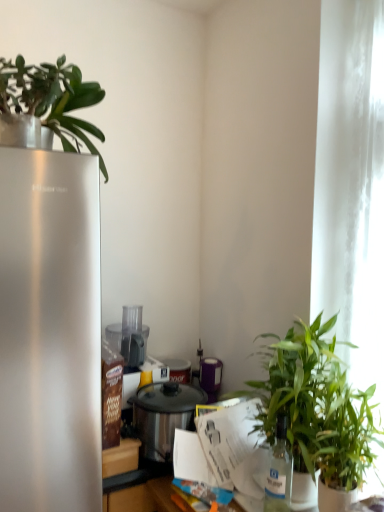
This screenshot has height=512, width=384. What do you see at coordinates (163, 416) in the screenshot?
I see `stainless steel pot at center` at bounding box center [163, 416].

In order to click on green leafy plant at right, the 2th houseplant in the right-to-left sequence in this screenshot , I will do `click(297, 393)`.

You are a GUI agent. You are given a task and a screenshot of the screen. Output one action in this format:
    pyautogui.click(x=<x>, y=<y>)
    Task: Click on the white glossy paper at center
    The height and width of the screenshot is (512, 384).
    Given the screenshot: What is the action you would take?
    point(232,445)

Identify the location of white sheer curtain at right. point(351,186).

Where is `stainless steel pot at center`? The width and height of the screenshot is (384, 512). stainless steel pot at center is located at coordinates (163, 416).

Considering the relative sizes of stainless steel pot at center and clear glass bottle at lower right in the image provided, is stainless steel pot at center shorter than clear glass bottle at lower right?

Correct, stainless steel pot at center is not as tall as clear glass bottle at lower right.

Does stainless steel pot at center have a larger size compared to clear glass bottle at lower right?

Indeed, stainless steel pot at center has a larger size compared to clear glass bottle at lower right.

Are stainless steel pot at center and clear glass bottle at lower right located far from each other?

Actually, stainless steel pot at center and clear glass bottle at lower right are a little close together.

Which of these two, stainless steel pot at center or clear glass bottle at lower right, is wider?

With larger width is stainless steel pot at center.

What's the angular difference between green matte plant at upper left, placed as the 1th houseplant when sorted from top to bottom, and clear glass bottle at lower right's facing directions?

There is a 87.2-degree angle between the facing directions of green matte plant at upper left, placed as the 1th houseplant when sorted from top to bottom, and clear glass bottle at lower right.

Is green matte plant at upper left, the third houseplant positioned from the right, oriented towards clear glass bottle at lower right?

No, green matte plant at upper left, the third houseplant positioned from the right, is not turned towards clear glass bottle at lower right.

Is green matte plant at upper left, placed as the 1th houseplant when sorted from top to bottom, shorter than clear glass bottle at lower right?

Indeed, green matte plant at upper left, placed as the 1th houseplant when sorted from top to bottom, has a lesser height compared to clear glass bottle at lower right.

From the image's perspective, is green matte plant at upper left, placed as the third houseplant when sorted from bottom to top, on top of clear glass bottle at lower right?

Correct, green matte plant at upper left, placed as the third houseplant when sorted from bottom to top, appears higher than clear glass bottle at lower right in the image.

Is green leafy plant at right, the 3th houseplant positioned from the top, looking in the opposite direction of green matte plant at upper left, the third houseplant positioned from the right?

No, green leafy plant at right, the 3th houseplant positioned from the top,'s orientation is not away from green matte plant at upper left, the third houseplant positioned from the right.

Between green leafy plant at right, the third houseplant positioned from the left, and green matte plant at upper left, the third houseplant positioned from the right, which one appears on the right side from the viewer's perspective?

From the viewer's perspective, green leafy plant at right, the third houseplant positioned from the left, appears more on the right side.

How different are the orientations of green leafy plant at right, the 3th houseplant positioned from the top, and green matte plant at upper left, placed as the 1th houseplant when sorted from top to bottom, in degrees?

The angular difference between green leafy plant at right, the 3th houseplant positioned from the top, and green matte plant at upper left, placed as the 1th houseplant when sorted from top to bottom, is 87.2 degrees.

Between green leafy plant at right, the 3th houseplant positioned from the top, and green matte plant at upper left, placed as the third houseplant when sorted from bottom to top, which one has larger width?

green leafy plant at right, the 3th houseplant positioned from the top, is wider.

From a real-world perspective, between green leafy plant at right, the 1th houseplant in the bottom-to-top sequence, and stainless steel pot at center, who is vertically lower?

From a 3D spatial view, stainless steel pot at center is below.

Who is smaller, green leafy plant at right, the 1th houseplant in the bottom-to-top sequence, or stainless steel pot at center?

stainless steel pot at center.

In terms of height, does green leafy plant at right, the 1th houseplant in the bottom-to-top sequence, look taller or shorter compared to stainless steel pot at center?

green leafy plant at right, the 1th houseplant in the bottom-to-top sequence, is taller than stainless steel pot at center.

Is stainless steel pot at center facing away from green leafy plant at right, the 1th houseplant positioned from the right?

No, green leafy plant at right, the 1th houseplant positioned from the right, is not at the back of stainless steel pot at center.

Is stainless steel pot at center surrounding green leafy plant at right, the 3th houseplant positioned from the top?

Definitely not — green leafy plant at right, the 3th houseplant positioned from the top, is not inside stainless steel pot at center.

Is point (169, 426) farther from camera compared to point (342, 464)?

That is True.

Is stainless steel pot at center smaller than green leafy plant at right, the third houseplant positioned from the left?

Yes, stainless steel pot at center is smaller than green leafy plant at right, the third houseplant positioned from the left.

Does green leafy plant at right, the 1th houseplant in the bottom-to-top sequence, have a greater width compared to white glossy paper at center?

Correct, the width of green leafy plant at right, the 1th houseplant in the bottom-to-top sequence, exceeds that of white glossy paper at center.

Does point (327, 421) appear closer or farther from the camera than point (213, 460)?

Point (327, 421).

How different are the orientations of green leafy plant at right, the 1th houseplant positioned from the right, and white glossy paper at center in degrees?

The angular difference between green leafy plant at right, the 1th houseplant positioned from the right, and white glossy paper at center is 85 degrees.

Is clear glass bottle at lower right completely or partially outside of green leafy plant at right, the second houseplant in the left-to-right sequence?

No.

Considering the sizes of objects clear glass bottle at lower right and green leafy plant at right, placed as the 2th houseplant when sorted from top to bottom, in the image provided, who is thinner, clear glass bottle at lower right or green leafy plant at right, placed as the 2th houseplant when sorted from top to bottom,?

With smaller width is clear glass bottle at lower right.

Which object is positioned more to the right, clear glass bottle at lower right or green leafy plant at right, the second houseplant in the left-to-right sequence?

green leafy plant at right, the second houseplant in the left-to-right sequence.

Identify the location of bottle below the stainless steel pot at center (from the image's perspective). The width and height of the screenshot is (384, 512). (279, 472).

Identify the location of houseplant on the left of clear glass bottle at lower right. This screenshot has height=512, width=384. (52, 99).

Which object lies further to the anchor point stainless steel pot at center, green matte plant at upper left, placed as the 1th houseplant when sorted from top to bottom, or clear glass bottle at lower right?

The object further to stainless steel pot at center is green matte plant at upper left, placed as the 1th houseplant when sorted from top to bottom.

When comparing their distances from clear glass bottle at lower right, does white ceramic pot at lower right or white sheer curtain at right seem further?

white sheer curtain at right lies further to clear glass bottle at lower right than the other object.

Looking at the image, which one is located closer to green leafy plant at right, the 2th houseplant in the right-to-left sequence, clear glass bottle at lower right or stainless steel pot at center?

Based on the image, clear glass bottle at lower right appears to be nearer to green leafy plant at right, the 2th houseplant in the right-to-left sequence.

When comparing their distances from white ceramic pot at lower right, does green leafy plant at right, the 3th houseplant positioned from the top, or white sheer curtain at right seem closer?

Among the two, green leafy plant at right, the 3th houseplant positioned from the top, is located nearer to white ceramic pot at lower right.

From the picture: Considering their positions, is green leafy plant at right, the 2th houseplant in the right-to-left sequence, positioned further to clear glass bottle at lower right than white glossy paper at center?

white glossy paper at center is further to clear glass bottle at lower right.

Considering their positions, is clear glass bottle at lower right positioned closer to green matte plant at upper left, the third houseplant positioned from the right, than stainless steel pot at center?

stainless steel pot at center is positioned closer to the anchor green matte plant at upper left, the third houseplant positioned from the right.

Estimate the real-world distances between objects in this image. Which object is closer to white sheer curtain at right, stainless steel pot at center or green leafy plant at right, the 1th houseplant in the bottom-to-top sequence?

Among the two, green leafy plant at right, the 1th houseplant in the bottom-to-top sequence, is located nearer to white sheer curtain at right.

Which object lies nearer to the anchor point green matte plant at upper left, the third houseplant positioned from the right, green leafy plant at right, the third houseplant positioned from the left, or stainless steel pot at center?

stainless steel pot at center lies closer to green matte plant at upper left, the third houseplant positioned from the right, than the other object.

The width and height of the screenshot is (384, 512). What are the coordinates of `bottle between white sheer curtain at right and white ceramic pot at lower right in the vertical direction` in the screenshot? It's located at click(x=279, y=472).

This screenshot has height=512, width=384. What are the coordinates of `paper that lies between green matte plant at upper left, placed as the third houseplant when sorted from bottom to top, and white ceramic pot at lower right from top to bottom` in the screenshot? It's located at (232, 445).

Identify the location of paper between white sheer curtain at right and white ceramic pot at lower right in the vertical direction. (232, 445).

Identify the location of bottle situated between stainless steel pot at center and green leafy plant at right, the 1th houseplant positioned from the right, from left to right. The width and height of the screenshot is (384, 512). (279, 472).